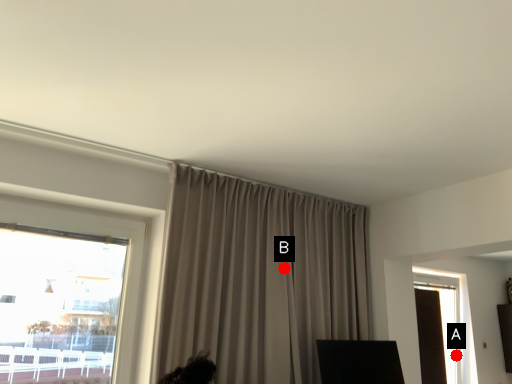
Question: Two points are circled on the image, labeled by A and B beside each circle. Which point is further to the camera?

Choices:
 (A) A is further
 (B) B is further

Answer: (A)